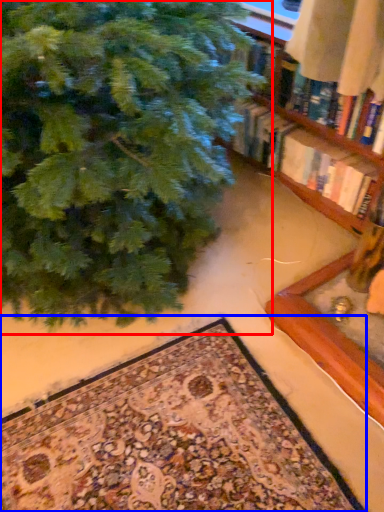
Question: Which of the following is the farthest to the observer, christmas tree (highlighted by a red box) or mat (highlighted by a blue box)?

Choices:
 (A) christmas tree
 (B) mat

Answer: (B)